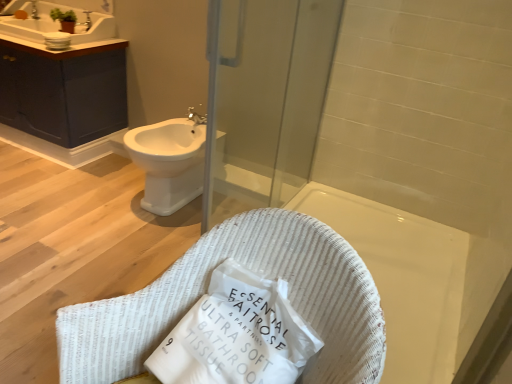
Question: Does silver metallic faucet at upper left, marked as the first faucet in a front-to-back arrangement, have a smaller size compared to white woven basket at center?

Choices:
 (A) yes
 (B) no

Answer: (A)

Question: Does silver metallic faucet at upper left, positioned as the second faucet in top-to-bottom order, have a greater height compared to white woven basket at center?

Choices:
 (A) yes
 (B) no

Answer: (B)

Question: Is silver metallic faucet at upper left, arranged as the 2th faucet when viewed from the back, not within white woven basket at center?

Choices:
 (A) yes
 (B) no

Answer: (A)

Question: Is silver metallic faucet at upper left, which appears as the second faucet when viewed from the left, not near white woven basket at center?

Choices:
 (A) no
 (B) yes

Answer: (B)

Question: Does silver metallic faucet at upper left, marked as the first faucet in a front-to-back arrangement, have a greater width compared to white woven basket at center?

Choices:
 (A) no
 (B) yes

Answer: (A)

Question: Would you say matte dark blue cabinet at upper left is inside or outside transparent glass screen door at upper center?

Choices:
 (A) inside
 (B) outside

Answer: (B)

Question: Based on their positions, is matte dark blue cabinet at upper left located to the left or right of transparent glass screen door at upper center?

Choices:
 (A) left
 (B) right

Answer: (A)

Question: Considering the positions of matte dark blue cabinet at upper left and transparent glass screen door at upper center in the image, is matte dark blue cabinet at upper left wider or thinner than transparent glass screen door at upper center?

Choices:
 (A) wide
 (B) thin

Answer: (A)

Question: Based on their sizes in the image, would you say matte dark blue cabinet at upper left is bigger or smaller than transparent glass screen door at upper center?

Choices:
 (A) small
 (B) big

Answer: (B)

Question: Is silver metallic faucet at upper left, which is the second faucet from front to back, to the left or to the right of white paper tissue at center in the image?

Choices:
 (A) right
 (B) left

Answer: (B)

Question: From a real-world perspective, is silver metallic faucet at upper left, which is counted as the first faucet, starting from the left, physically located above or below white paper tissue at center?

Choices:
 (A) above
 (B) below

Answer: (A)

Question: Is silver metallic faucet at upper left, which is counted as the first faucet, starting from the left, inside or outside of white paper tissue at center?

Choices:
 (A) outside
 (B) inside

Answer: (A)

Question: From their relative heights in the image, would you say silver metallic faucet at upper left, positioned as the second faucet in bottom-to-top order, is taller or shorter than white paper tissue at center?

Choices:
 (A) tall
 (B) short

Answer: (B)

Question: Is matte dark blue cabinet at upper left to the left or to the right of silver metallic faucet at upper left, which appears as the second faucet when viewed from the left, in the image?

Choices:
 (A) left
 (B) right

Answer: (A)

Question: Considering their positions, is matte dark blue cabinet at upper left located in front of or behind silver metallic faucet at upper left, the first faucet viewed from the right?

Choices:
 (A) behind
 (B) front

Answer: (B)